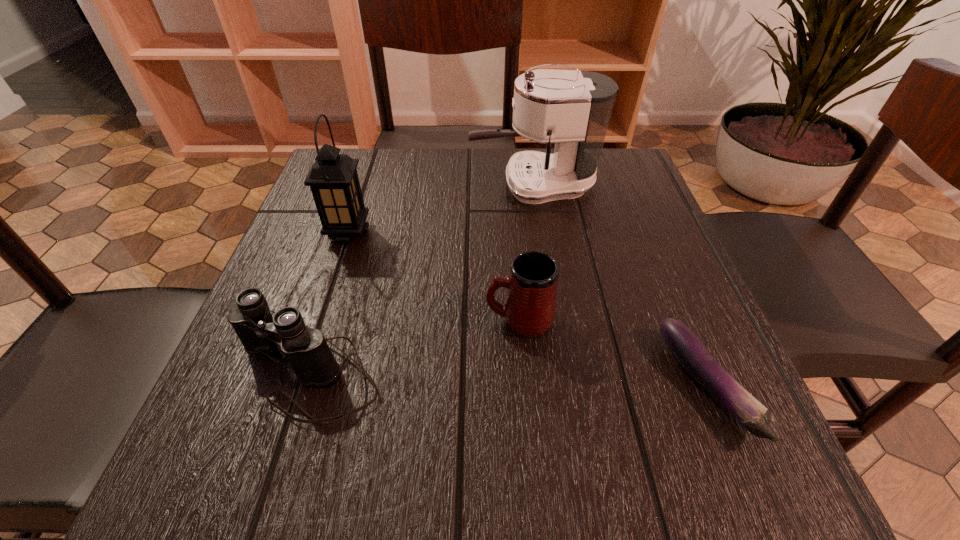
Image resolution: width=960 pixels, height=540 pixels. Find the location of `eggplant at the right edge`. eggplant at the right edge is located at coordinates (690, 352).

The image size is (960, 540). I want to click on object located in the far right corner section of the desktop, so click(571, 108).

The width and height of the screenshot is (960, 540). Find the location of `object that is at the near right corner`. object that is at the near right corner is located at coordinates (690, 352).

This screenshot has height=540, width=960. Identify the location of vacant space at the far edge of the desktop. (469, 192).

In the image, there is a desktop. Identify the location of free space at the near edge. (442, 466).

The height and width of the screenshot is (540, 960). In order to click on vacant space at the left edge of the desktop in this screenshot , I will do `click(375, 217)`.

Locate an element on the screen. free point at the right edge is located at coordinates tap(629, 297).

Where is `free region at the far left corner`? free region at the far left corner is located at coordinates (392, 156).

The height and width of the screenshot is (540, 960). What are the coordinates of `vacant space at the near left corner of the desktop` in the screenshot? It's located at (218, 484).

The width and height of the screenshot is (960, 540). I want to click on empty space between the binoculars and the farthest object, so click(420, 279).